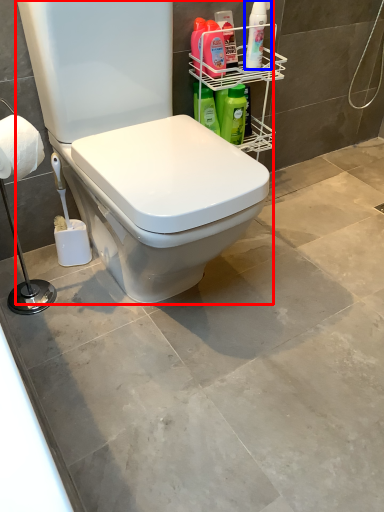
Question: Among these objects, which one is nearest to the camera, toilet (highlighted by a red box) or cleaning product (highlighted by a blue box)?

Choices:
 (A) toilet
 (B) cleaning product

Answer: (A)